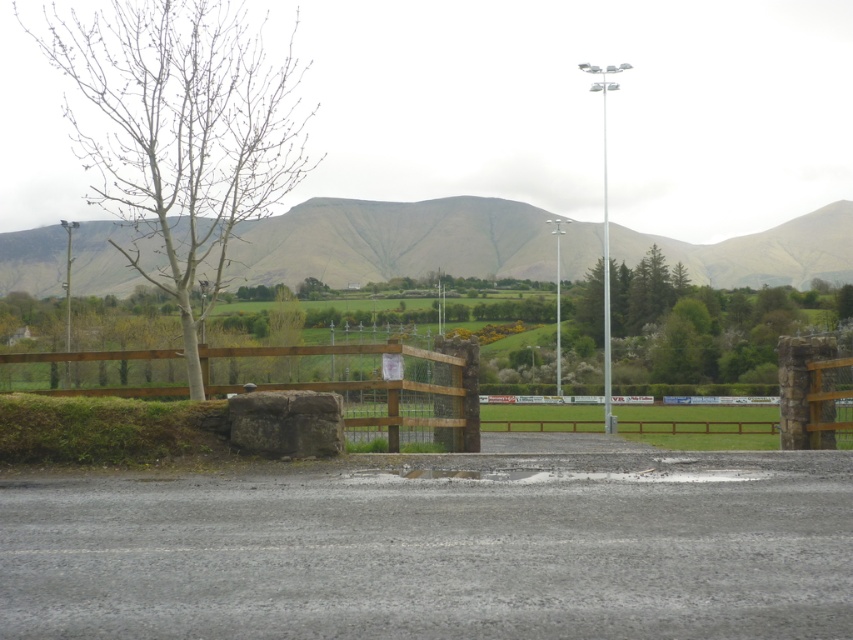
You are a pedestrian walking along the road and want to take a photo of both the bare wood tree at left and the brown wooden fence at lower left. Which object should you position closer to you in the frame to ensure both are visible?

To ensure both the bare wood tree at left and the brown wooden fence at lower left are visible in the photo, position the bare wood tree at left closer to you in the frame since it is in front of the brown wooden fence at lower left.

You are standing at the starting point of the road in the image. You see two points marked on the road. The first point is at coordinates point (85,38) and the second point is at point (55,240). Which point is closer to you as you face the road ahead?

Point (85,38) is in front of point (55,240), so the first point is closer to you.